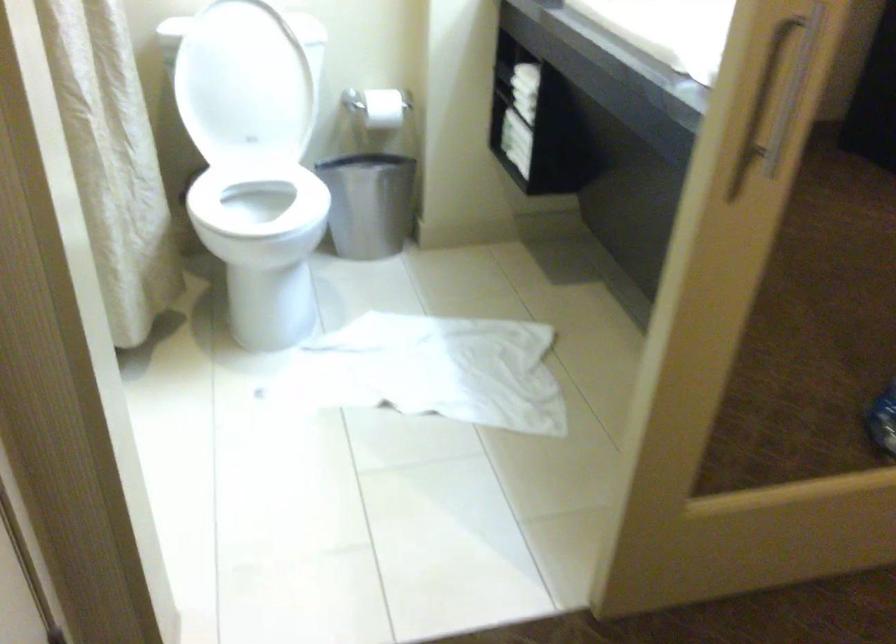
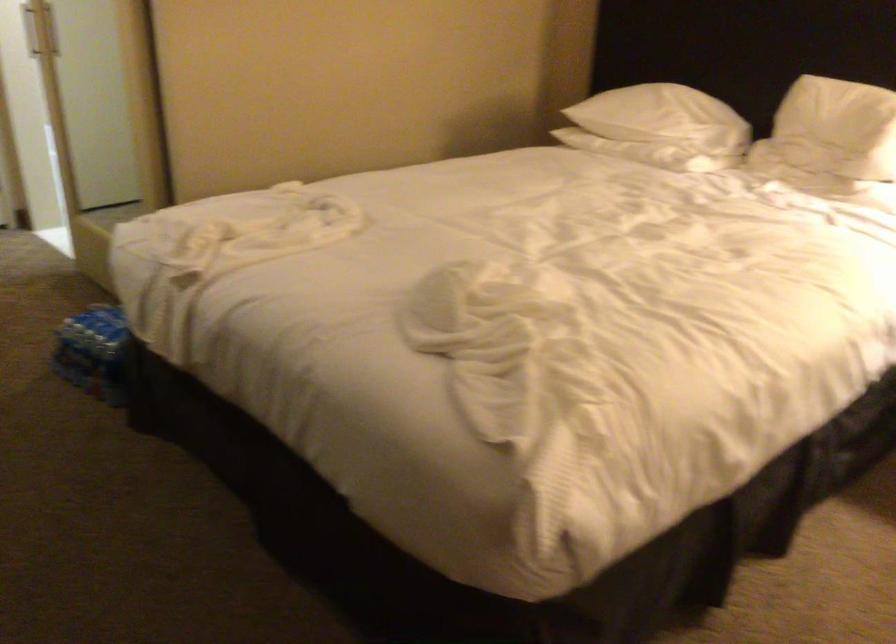
Question: I am providing you with two images of the same scene from different viewpoints. After the viewpoint changes to image2, which objects are now occluded?

Choices:
 (A) white pillow
 (B) plastic water bottle
 (C) cork jar lid
 (D) white towel

Answer: (D)